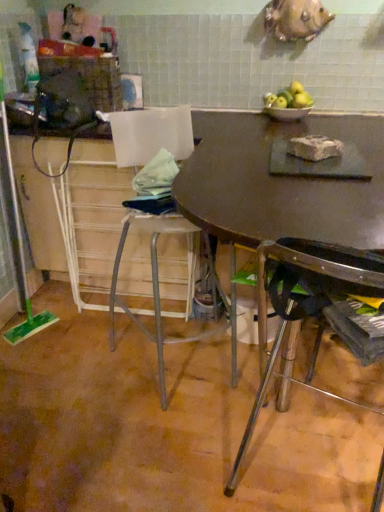
Locate an element on the screen. vacant area that lies to the right of green plastic screen door at left is located at coordinates (52, 304).